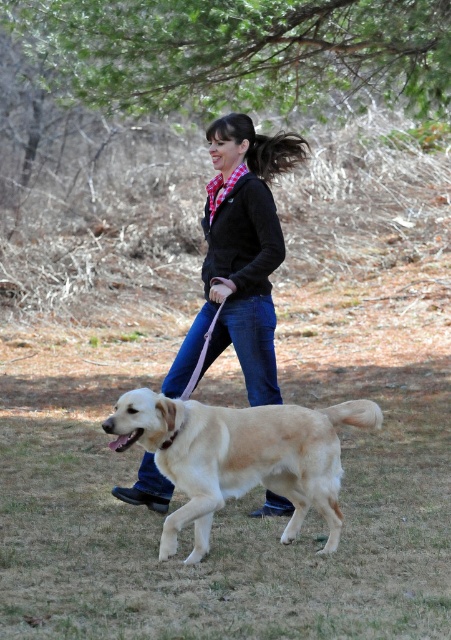
Consider the image. Measure the distance between golden fur dog at center and camera.

The distance of golden fur dog at center from camera is 14.99 feet.

Which is behind, point (216, 442) or point (180, 378)?

Positioned behind is point (180, 378).

Is point (285, 420) farther from camera compared to point (274, 355)?

No, it is in front of (274, 355).

At what (x,y) coordinates should I click in order to perform the action: click on golden fur dog at center. Please return your answer as a coordinate pair (x, y). Looking at the image, I should click on (239, 456).